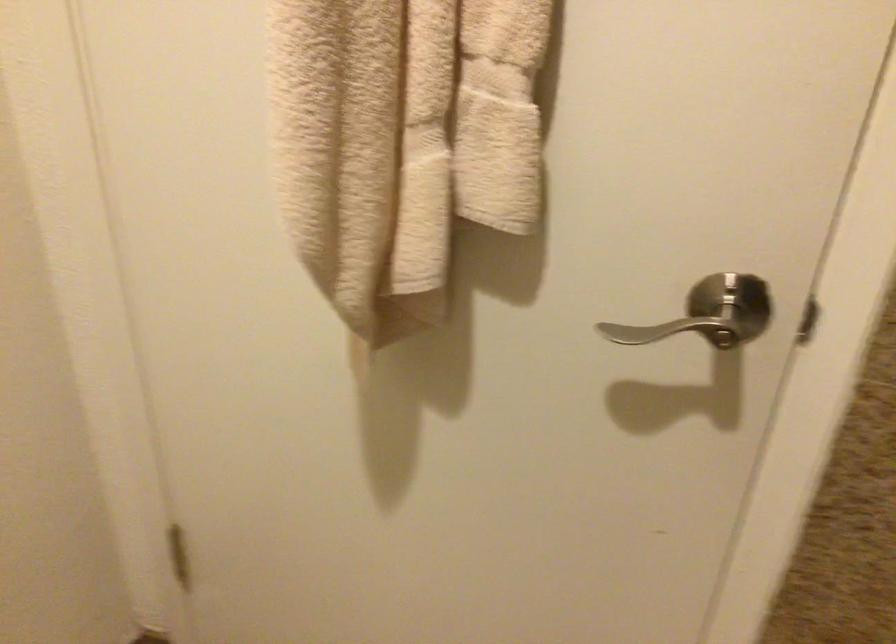
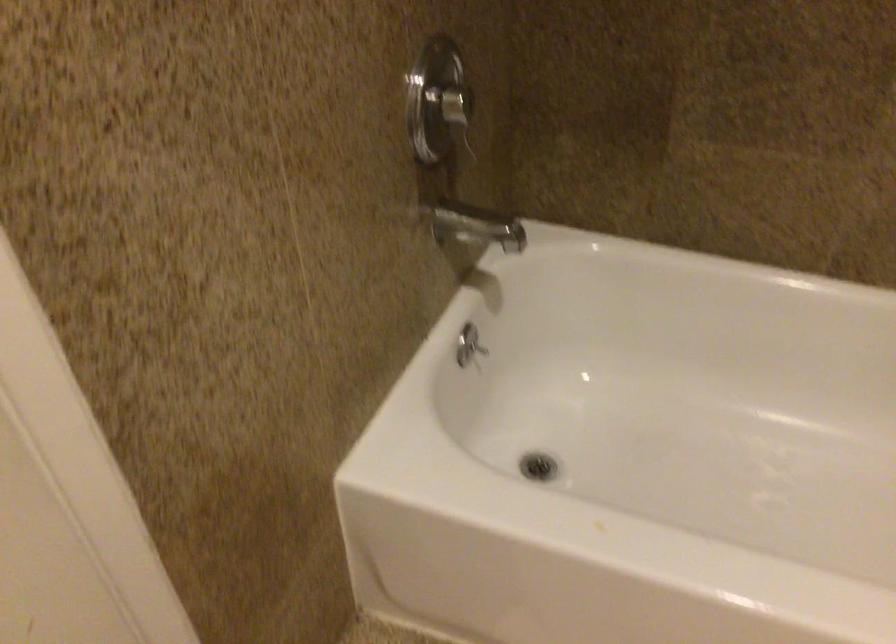
The first image is from the beginning of the video and the second image is from the end. How did the camera likely rotate when shooting the video?

The camera rotated toward right-down.